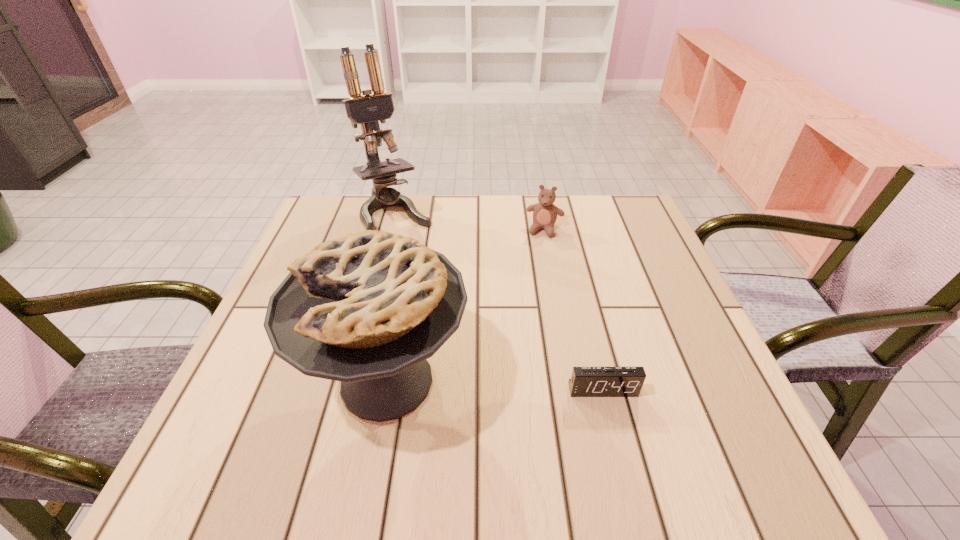
Locate an element on the screen. vacant space that is in between the tallest object and the alarm clock is located at coordinates (499, 303).

Locate an element on the screen. The width and height of the screenshot is (960, 540). vacant area that lies between the microscope and the alarm clock is located at coordinates (499, 303).

Locate an element on the screen. The image size is (960, 540). the closest object to the shortest object is located at coordinates (367, 309).

Locate an element on the screen. This screenshot has height=540, width=960. the third closest object to the tallest object is located at coordinates (585, 381).

You are a GUI agent. You are given a task and a screenshot of the screen. Output one action in this format:
    pyautogui.click(x=<x>, y=<y>)
    Task: Click on the vacant region that satisfies the following two spatial constraints: 1. on the front side of the pie; 2. on the cut side of the tallest object
    Image resolution: width=960 pixels, height=540 pixels.
    Given the screenshot: What is the action you would take?
    pyautogui.click(x=354, y=381)